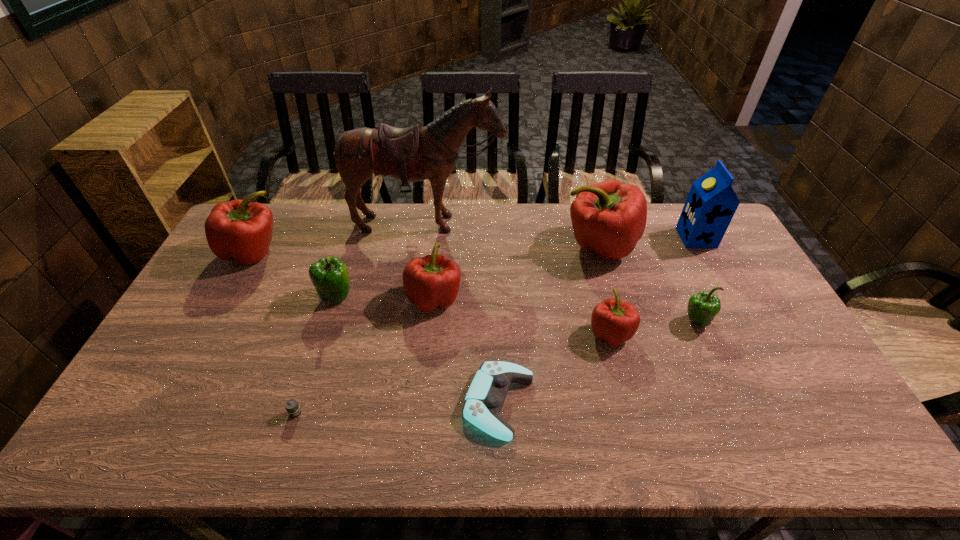
This screenshot has height=540, width=960. In order to click on control present at the near edge in this screenshot , I will do `click(486, 395)`.

I want to click on beer can that is positioned at the near edge, so click(x=292, y=407).

Locate an element on the screen. object present at the left edge is located at coordinates (239, 230).

The height and width of the screenshot is (540, 960). Find the location of `object positioned at the right edge`. object positioned at the right edge is located at coordinates (711, 204).

The width and height of the screenshot is (960, 540). Find the location of `object located at the far left corner`. object located at the far left corner is located at coordinates (239, 230).

At what (x,y) coordinates should I click in order to perform the action: click on object that is at the far right corner. Please return your answer as a coordinate pair (x, y). The height and width of the screenshot is (540, 960). Looking at the image, I should click on (711, 204).

The image size is (960, 540). In order to click on vacant region at the far edge in this screenshot , I will do `click(515, 210)`.

Locate an element on the screen. Image resolution: width=960 pixels, height=540 pixels. free point at the near edge is located at coordinates (582, 441).

The width and height of the screenshot is (960, 540). Identify the location of vacant space at the left edge of the desktop. (257, 262).

The height and width of the screenshot is (540, 960). In the image, there is a desktop. What are the coordinates of `free space at the right edge` in the screenshot? It's located at click(701, 259).